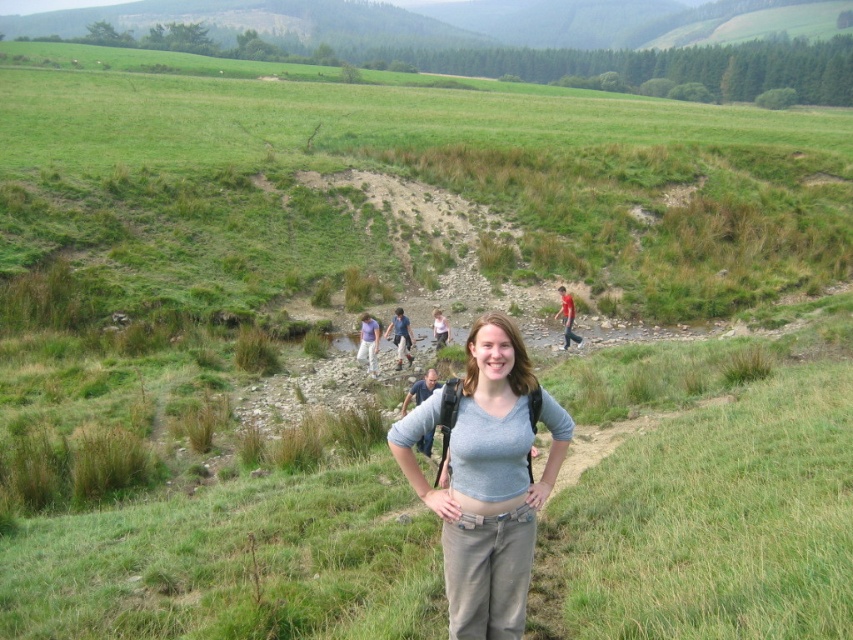
You are a photographer positioned at the center of the image. You notice two people in the midground, one wearing blue denim jeans at center and another in red shirt at center. Which direction should you move to frame both subjects within your camera viewfinder?

You should move to the right because the blue denim jeans at center is to the left of red shirt at center, so shifting your position to the right would help include both subjects in the frame.

You are a hiker who just arrived at the scenic spot. You notice a gray fabric backpack at center and a matte blue shirt at center. Which object is positioned to the right side?

The gray fabric backpack at center is to the right of matte blue shirt at center.